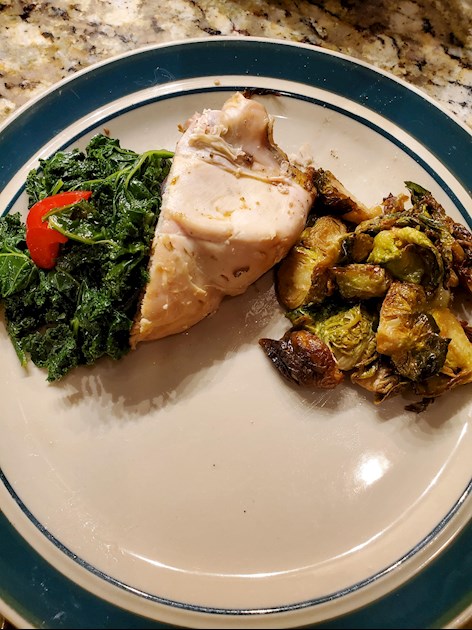
The height and width of the screenshot is (630, 472). I want to click on counter, so click(x=124, y=33).